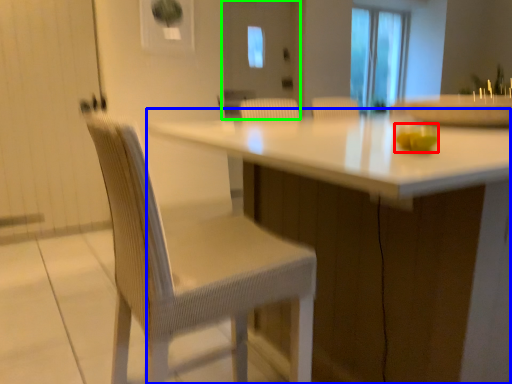
Question: Which object is the closest to the food (highlighted by a red box)? Choose among these: table (highlighted by a blue box) or screen door (highlighted by a green box).

Choices:
 (A) table
 (B) screen door

Answer: (A)